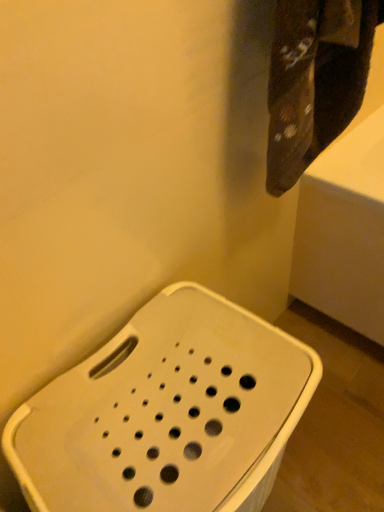
Question: Is dark brown fabric at upper right taller than white plastic stool at lower left?

Choices:
 (A) no
 (B) yes

Answer: (A)

Question: Would you consider dark brown fabric at upper right to be distant from white plastic stool at lower left?

Choices:
 (A) no
 (B) yes

Answer: (A)

Question: From a real-world perspective, is dark brown fabric at upper right over white plastic stool at lower left?

Choices:
 (A) yes
 (B) no

Answer: (A)

Question: Considering the relative sizes of dark brown fabric at upper right and white plastic stool at lower left in the image provided, is dark brown fabric at upper right wider than white plastic stool at lower left?

Choices:
 (A) no
 (B) yes

Answer: (A)

Question: From a real-world perspective, is dark brown fabric at upper right positioned under white plastic stool at lower left based on gravity?

Choices:
 (A) yes
 (B) no

Answer: (B)

Question: Can you confirm if dark brown fabric at upper right is smaller than white plastic stool at lower left?

Choices:
 (A) yes
 (B) no

Answer: (A)

Question: From the image's perspective, is white plastic stool at lower left under dark brown fabric at upper right?

Choices:
 (A) no
 (B) yes

Answer: (B)

Question: Considering the relative positions of white plastic stool at lower left and dark brown fabric at upper right in the image provided, is white plastic stool at lower left in front of dark brown fabric at upper right?

Choices:
 (A) yes
 (B) no

Answer: (A)

Question: Is white plastic stool at lower left not inside dark brown fabric at upper right?

Choices:
 (A) no
 (B) yes

Answer: (B)

Question: Is white plastic stool at lower left facing away from dark brown fabric at upper right?

Choices:
 (A) no
 (B) yes

Answer: (A)

Question: Is white plastic stool at lower left further to the viewer compared to dark brown fabric at upper right?

Choices:
 (A) no
 (B) yes

Answer: (A)

Question: Does white plastic stool at lower left appear on the right side of dark brown fabric at upper right?

Choices:
 (A) no
 (B) yes

Answer: (A)

Question: Considering the positions of point (296, 133) and point (74, 482), is point (296, 133) closer or farther from the camera than point (74, 482)?

Choices:
 (A) farther
 (B) closer

Answer: (A)